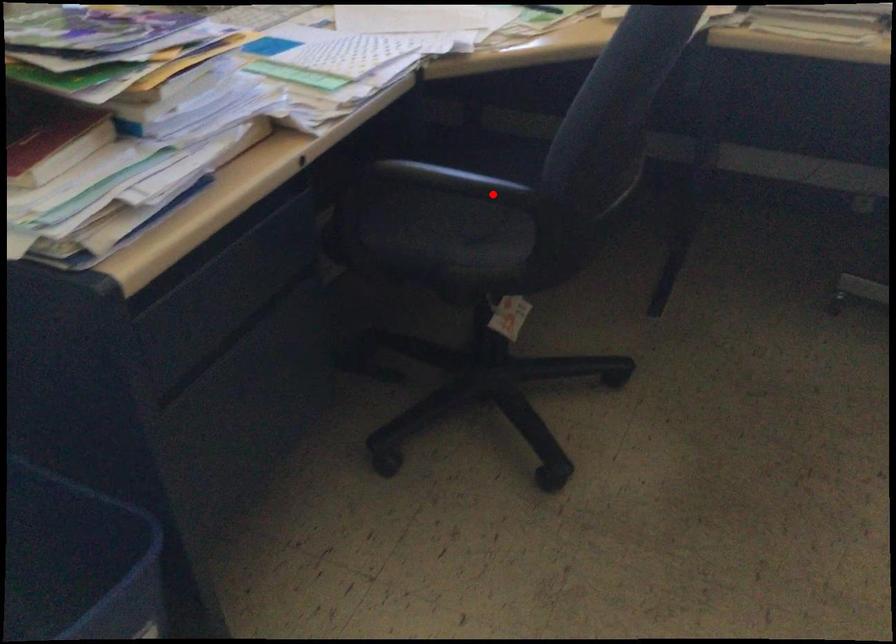
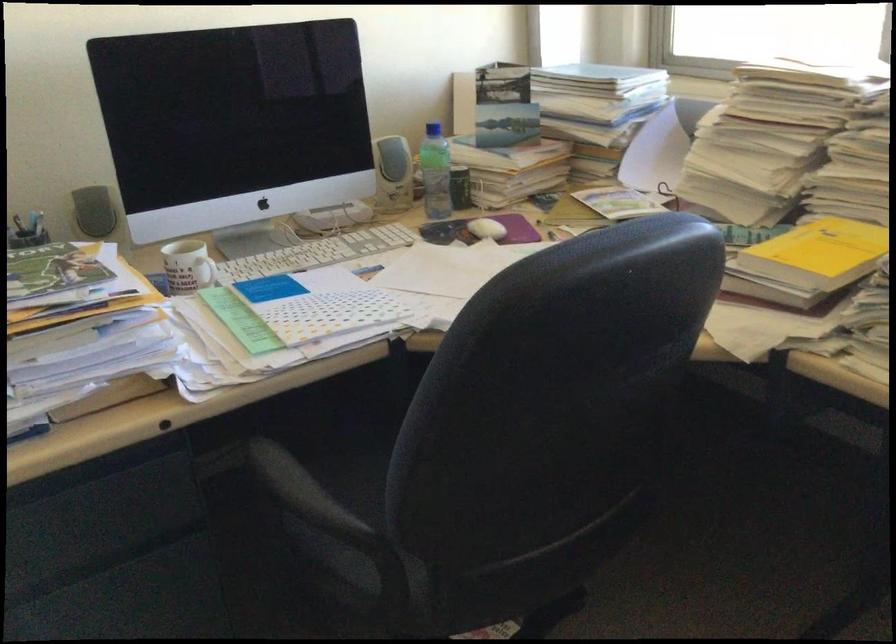
Locate, in the second image, the point that corresponds to the highlighted location in the first image.

(314, 521)